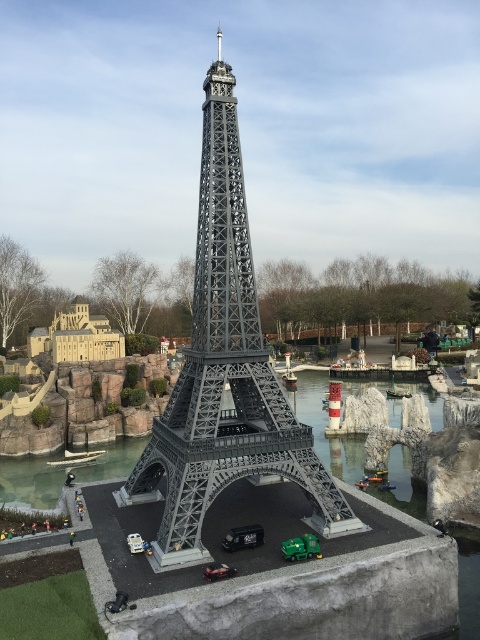
Can you confirm if metallic gray eiffel tower at center is bigger than green plastic car at center?

Yes.

Does point (194, 381) come in front of point (213, 566)?

That is False.

At what (x,y) coordinates should I click in order to perform the action: click on metallic gray eiffel tower at center. Please return your answer as a coordinate pair (x, y). Looking at the image, I should click on (225, 371).